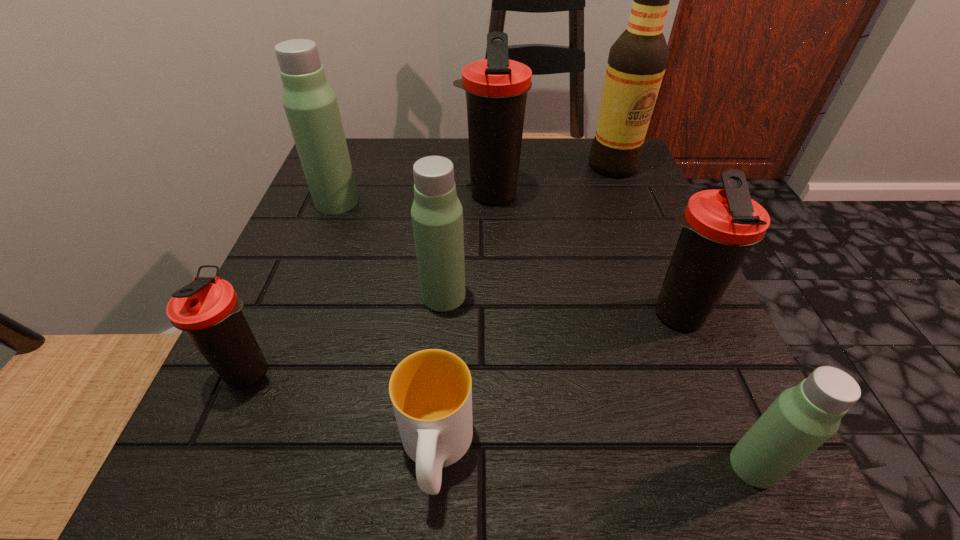
Identify the location of the tallest object. (637, 61).

Image resolution: width=960 pixels, height=540 pixels. I want to click on beige alcohol, so click(637, 61).

In order to click on the biggest brown thermos bottle in this screenshot , I will do pyautogui.click(x=496, y=88).

Locate an element on the screen. the farthest brown thermos bottle is located at coordinates (496, 88).

Image resolution: width=960 pixels, height=540 pixels. I want to click on the leftmost light thermos bottle, so click(310, 104).

This screenshot has height=540, width=960. I want to click on the biggest light thermos bottle, so click(x=310, y=104).

The image size is (960, 540). I want to click on the second biggest brown thermos bottle, so click(719, 227).

This screenshot has width=960, height=540. Identify the location of the second farthest brown thermos bottle. (719, 227).

Identify the location of the second smallest light thermos bottle. (437, 215).

What are the coordinates of `the second farthest light thermos bottle` in the screenshot? It's located at (437, 215).